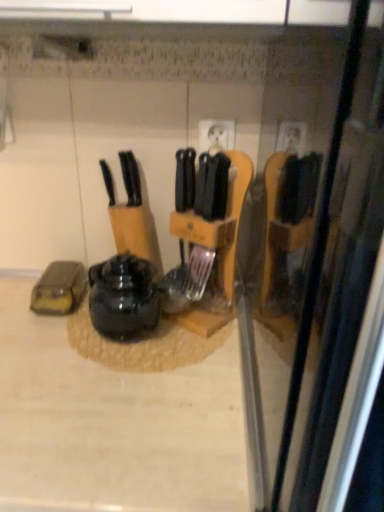
Find the location of a particular element. Image resolution: width=384 pixels, height=512 pixels. vacant area to the right of shiny black kettle at center is located at coordinates (209, 357).